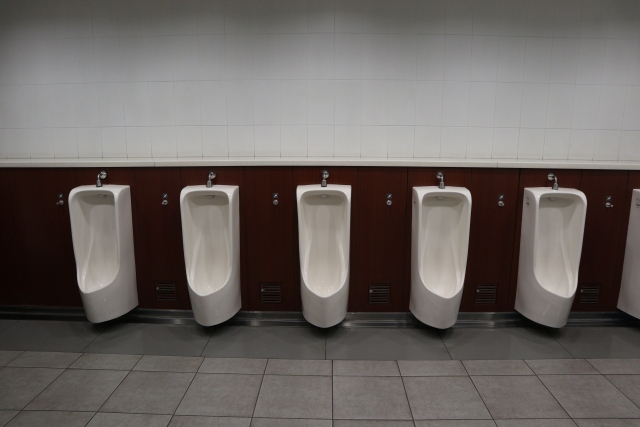
You are a GUI agent. You are given a task and a screenshot of the screen. Output one action in this format:
    pyautogui.click(x=<x>, y=<y>)
    Task: Click on the urinals
    The image size is (640, 427).
    Given the screenshot: What is the action you would take?
    pyautogui.click(x=95, y=242), pyautogui.click(x=202, y=248), pyautogui.click(x=324, y=240), pyautogui.click(x=436, y=245), pyautogui.click(x=552, y=239), pyautogui.click(x=628, y=260)